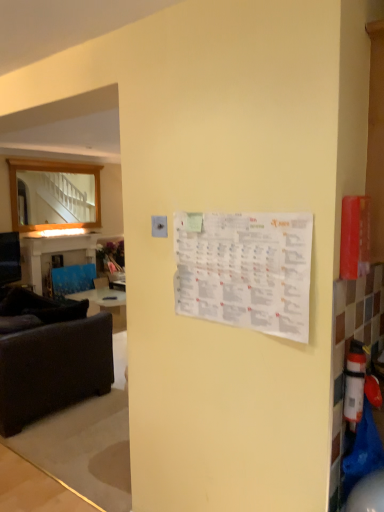
In order to face dark brown fabric studio couch at left, should I rotate leftwards or rightwards?

You should rotate left by 24.510 degrees.

In order to click on blue fabric table at left in this screenshot , I will do `click(58, 251)`.

Do you think wooden frame mirror at left is within white paper calendar at center, or outside of it?

wooden frame mirror at left cannot be found inside white paper calendar at center.

From their relative heights in the image, would you say wooden frame mirror at left is taller or shorter than white paper calendar at center?

Clearly, wooden frame mirror at left is taller compared to white paper calendar at center.

Is point (27, 183) positioned in front of point (280, 233)?

No, it is behind (280, 233).

Is wooden frame mirror at left aimed at blue fabric table at left?

No, wooden frame mirror at left is not oriented towards blue fabric table at left.

Considering the sizes of wooden frame mirror at left and blue fabric table at left in the image, is wooden frame mirror at left bigger or smaller than blue fabric table at left?

In the image, wooden frame mirror at left appears to be smaller than blue fabric table at left.

Can you tell me how much wooden frame mirror at left and blue fabric table at left differ in facing direction?

The angular difference between wooden frame mirror at left and blue fabric table at left is 0.158 degrees.

Between wooden frame mirror at left and blue fabric table at left, which one is positioned in front?

wooden frame mirror at left is more forward.

Looking at this image, from a real-world perspective, is dark brown fabric studio couch at left under white paper calendar at center?

Yes, from a real-world perspective, dark brown fabric studio couch at left is beneath white paper calendar at center.

Who is shorter, dark brown fabric studio couch at left or white paper calendar at center?

white paper calendar at center.

Does dark brown fabric studio couch at left come behind white paper calendar at center?

Yes, the depth of dark brown fabric studio couch at left is greater than that of white paper calendar at center.

Based on their positions, is wooden frame mirror at left located to the left or right of dark brown fabric studio couch at left?

From the image, it's evident that wooden frame mirror at left is to the left of dark brown fabric studio couch at left.

Consider the image. Is wooden frame mirror at left aimed at dark brown fabric studio couch at left?

No, wooden frame mirror at left is not aimed at dark brown fabric studio couch at left.

Looking at this image, in the image, is wooden frame mirror at left on the left side or the right side of white plastic extinguisher at right?

Based on their positions, wooden frame mirror at left is located to the left of white plastic extinguisher at right.

Is wooden frame mirror at left closer to camera compared to white plastic extinguisher at right?

That is False.

Is wooden frame mirror at left positioned beyond the bounds of white plastic extinguisher at right?

wooden frame mirror at left is positioned outside white plastic extinguisher at right.

Does wooden frame mirror at left turn towards white plastic extinguisher at right?

Yes, wooden frame mirror at left is aimed at white plastic extinguisher at right.

Considering the relative sizes of velvet blue armchair at left and blue fabric table at left in the image provided, is velvet blue armchair at left smaller than blue fabric table at left?

Indeed, velvet blue armchair at left has a smaller size compared to blue fabric table at left.

Which is in front, velvet blue armchair at left or blue fabric table at left?

blue fabric table at left is in front.

Is velvet blue armchair at left completely or partially outside of blue fabric table at left?

No, velvet blue armchair at left is inside or overlapping with blue fabric table at left.

Consider the image. Is velvet blue armchair at left at the left side of blue fabric table at left?

Incorrect, velvet blue armchair at left is not on the left side of blue fabric table at left.

Is point (264, 244) positioned after point (86, 379)?

That is False.

Is dark brown fabric studio couch at left surrounded by white paper calendar at center?

No, white paper calendar at center does not contain dark brown fabric studio couch at left.

I want to click on poster above the dark brown fabric studio couch at left (from a real-world perspective), so click(245, 270).

Is white paper calendar at center facing towards dark brown fabric studio couch at left?

No, white paper calendar at center is not facing towards dark brown fabric studio couch at left.

In order to click on poster below the wooden frame mirror at left (from the image's perspective) in this screenshot , I will do `click(245, 270)`.

Find the location of a particular element. Image resolution: width=384 pixels, height=512 pixels. table behind the wooden frame mirror at left is located at coordinates (58, 251).

Looking at the image, which one is located further to white paper calendar at center, white plastic extinguisher at right or blue fabric table at left?

blue fabric table at left is further to white paper calendar at center.

Which object lies further to the anchor point white plastic extinguisher at right, velvet blue armchair at left or white paper calendar at center?

velvet blue armchair at left is positioned further to the anchor white plastic extinguisher at right.

Which object lies nearer to the anchor point white plastic extinguisher at right, white paper calendar at center or velvet blue armchair at left?

Among the two, white paper calendar at center is located nearer to white plastic extinguisher at right.

Looking at the image, which one is located further to white plastic extinguisher at right, wooden frame mirror at left or dark brown fabric studio couch at left?

wooden frame mirror at left lies further to white plastic extinguisher at right than the other object.

Which object lies further to the anchor point white paper calendar at center, white plastic extinguisher at right or wooden frame mirror at left?

Among the two, wooden frame mirror at left is located further to white paper calendar at center.

Based on the photo, when comparing their distances from wooden frame mirror at left, does velvet blue armchair at left or blue fabric table at left seem further?

velvet blue armchair at left is further to wooden frame mirror at left.

Based on their spatial positions, is white plastic extinguisher at right or wooden frame mirror at left closer to velvet blue armchair at left?

The object closer to velvet blue armchair at left is wooden frame mirror at left.

From the image, which object appears to be nearer to dark brown fabric studio couch at left, blue fabric table at left or wooden frame mirror at left?

Among the two, blue fabric table at left is located nearer to dark brown fabric studio couch at left.

Find the location of a particular element. table located between white plastic extinguisher at right and velvet blue armchair at left in the depth direction is located at coordinates click(x=58, y=251).

The image size is (384, 512). I want to click on extinguisher between white paper calendar at center and velvet blue armchair at left along the z-axis, so click(354, 384).

Find the location of a particular element. The height and width of the screenshot is (512, 384). table between white paper calendar at center and velvet blue armchair at left from front to back is located at coordinates (58, 251).

At what (x,y) coordinates should I click in order to perform the action: click on extinguisher located between white paper calendar at center and blue fabric table at left in the depth direction. Please return your answer as a coordinate pair (x, y). The width and height of the screenshot is (384, 512). Looking at the image, I should click on (354, 384).